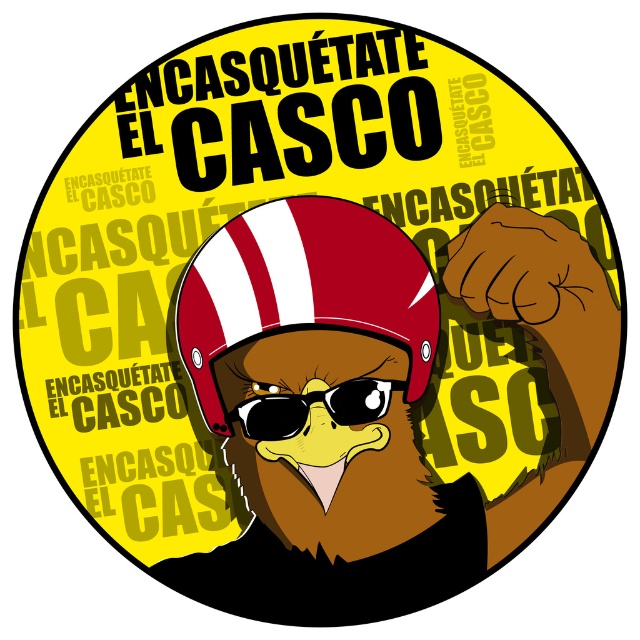
Does shiny red helmet at center have a lesser width compared to sunglassestransparent at center?

In fact, shiny red helmet at center might be wider than sunglassestransparent at center.

I want to click on shiny red helmet at center, so click(x=301, y=296).

I want to click on shiny red helmet at center, so (x=301, y=296).